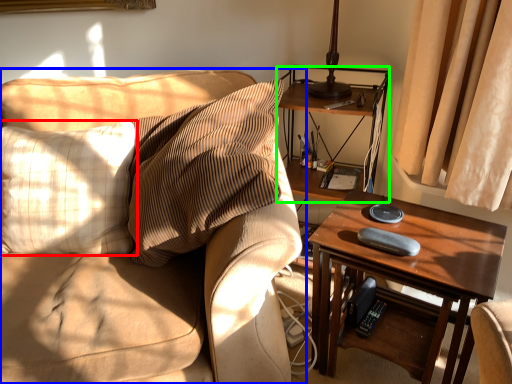
Question: Considering the real-world distances, which object is farthest from pillow (highlighted by a red box)? studio couch (highlighted by a blue box) or shelf (highlighted by a green box)?

Choices:
 (A) studio couch
 (B) shelf

Answer: (B)